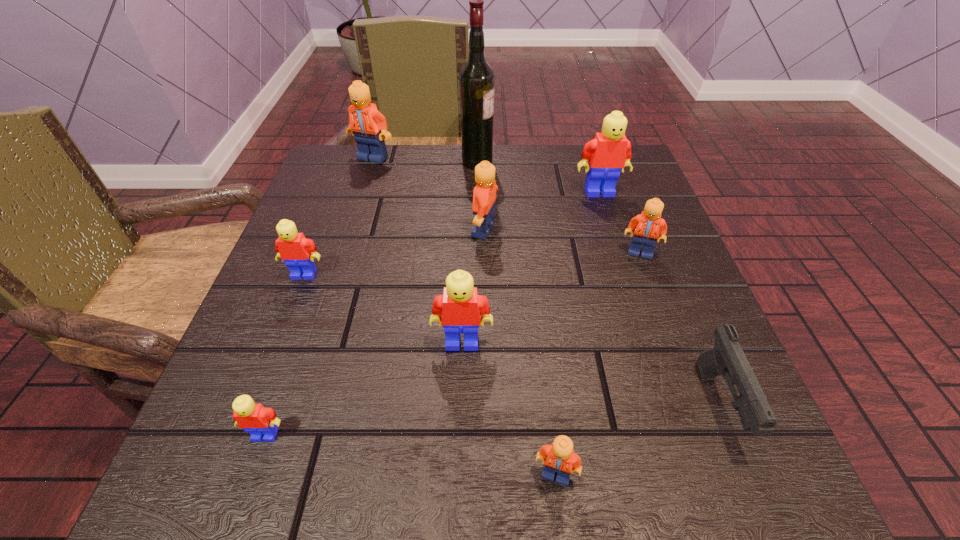
At what (x,y) coordinates should I click in order to perform the action: click on the tallest object. Please return your answer as a coordinate pair (x, y). This screenshot has width=960, height=540. Looking at the image, I should click on (476, 79).

The width and height of the screenshot is (960, 540). I want to click on the biggest orange Lego, so click(x=369, y=127).

Locate an element on the screen. The image size is (960, 540). the farthest orange Lego is located at coordinates (369, 127).

Locate an element on the screen. the seventh nearest Lego is located at coordinates (609, 152).

I want to click on the third farthest object, so click(609, 152).

Find the location of a particular element. The height and width of the screenshot is (540, 960). the third smallest orange Lego is located at coordinates (484, 196).

You are a GUI agent. You are given a task and a screenshot of the screen. Output one action in this format:
    pyautogui.click(x=<x>, y=<y>)
    Task: Click on the third smallest yellow Lego
    The height and width of the screenshot is (540, 960).
    Given the screenshot: What is the action you would take?
    pyautogui.click(x=461, y=307)

At what (x,y) coordinates should I click in order to perform the action: click on the fourth nearest object. Please return your answer as a coordinate pair (x, y). Looking at the image, I should click on (461, 307).

You are a GUI agent. You are given a task and a screenshot of the screen. Output one action in this format:
    pyautogui.click(x=<x>, y=<y>)
    Task: Click on the rightmost orange Lego
    
    Given the screenshot: What is the action you would take?
    pyautogui.click(x=647, y=225)

The width and height of the screenshot is (960, 540). I want to click on the second smallest yellow Lego, so click(298, 252).